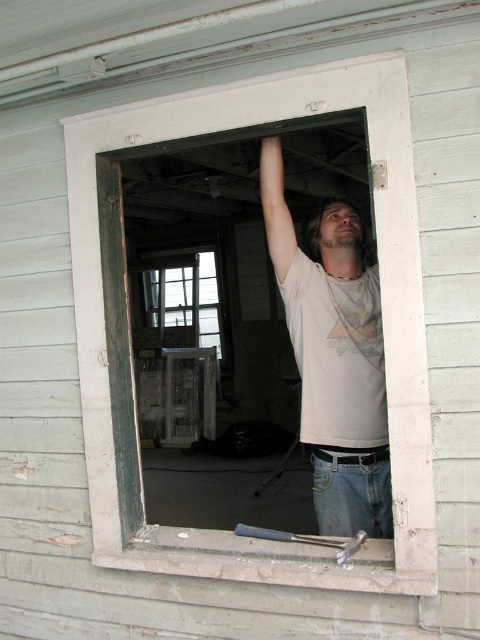
Where is `white painted wood at center`? The height and width of the screenshot is (640, 480). white painted wood at center is located at coordinates (129, 330).

Does white painted wood at center appear on the right side of white cotton shirt at center?

Incorrect, white painted wood at center is not on the right side of white cotton shirt at center.

Locate an element on the screen. The width and height of the screenshot is (480, 640). white painted wood at center is located at coordinates (129, 330).

This screenshot has height=640, width=480. What are the coordinates of `white painted wood at center` in the screenshot? It's located at tap(129, 330).